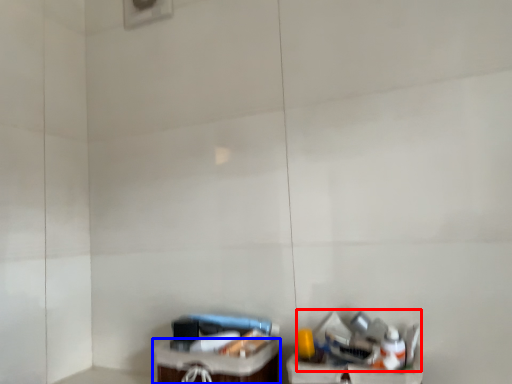
Question: Which object appears farthest to the camera in this image, garbage (highlighted by a red box) or furniture (highlighted by a blue box)?

Choices:
 (A) garbage
 (B) furniture

Answer: (B)